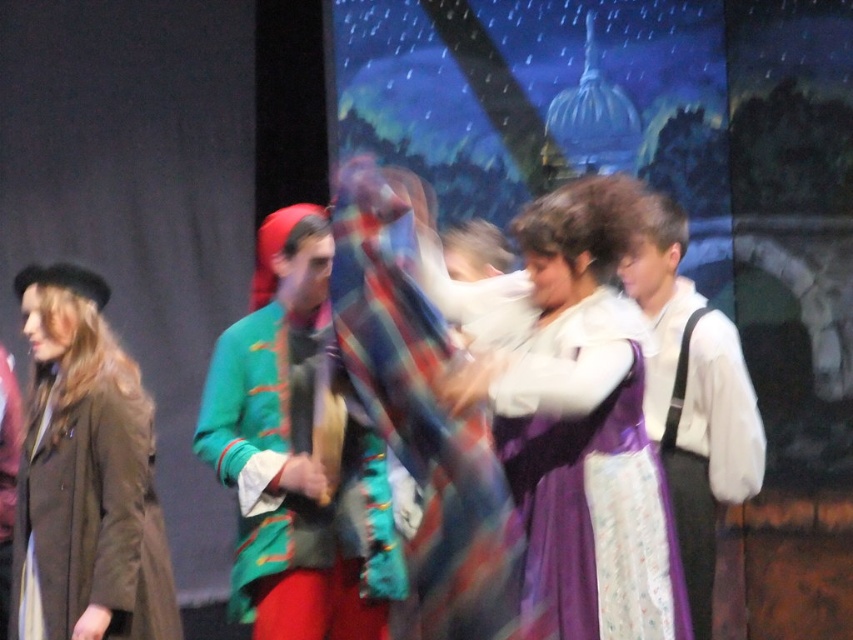
You are an assistant helping to organize costumes for a play. You have two items to place on a rack. The matte brown coat at left and the white cotton shirt at right. Which item requires more space on the rack?

The white cotton shirt at right requires more space on the rack because it is larger than the matte brown coat at left.

From the picture: In the nighttime performance scene with a starry sky and historical costumes, there is a green velvet jacket at center and a white cotton shirt at right. Which clothing item is positioned lower in the image?

The green velvet jacket at center is located below the white cotton shirt at right, so it is positioned lower in the image.